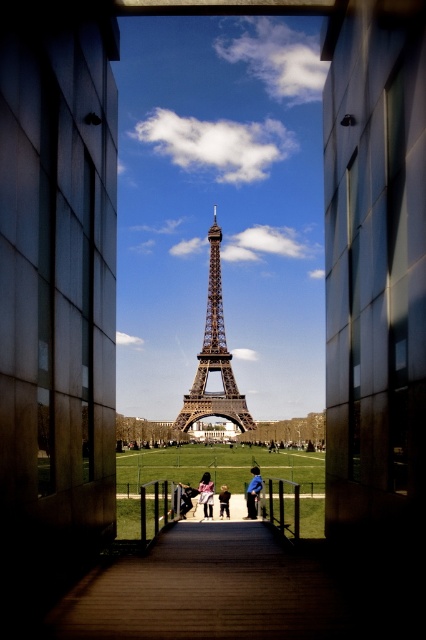
Is shiny metallic eiffel tower at center below matte pink dress at center?

No, shiny metallic eiffel tower at center is not below matte pink dress at center.

Which is more to the left, shiny metallic eiffel tower at center or matte pink dress at center?

matte pink dress at center

Is point (241, 422) positioned before point (204, 508)?

Yes.

This screenshot has height=640, width=426. In order to click on shiny metallic eiffel tower at center in this screenshot , I will do `click(213, 356)`.

Image resolution: width=426 pixels, height=640 pixels. What do you see at coordinates (253, 492) in the screenshot?
I see `blue fabric pants at center` at bounding box center [253, 492].

Can you confirm if blue fabric pants at center is positioned above matte pink dress at center?

Yes, blue fabric pants at center is above matte pink dress at center.

Is point (259, 492) behind point (212, 500)?

Yes.

The image size is (426, 640). What are the coordinates of `blue fabric pants at center` in the screenshot? It's located at (253, 492).

Does shiny metallic eiffel tower at center appear under blue fabric pants at center?

Actually, shiny metallic eiffel tower at center is above blue fabric pants at center.

Which is in front, point (230, 381) or point (252, 472)?

Point (230, 381)

I want to click on shiny metallic eiffel tower at center, so click(213, 356).